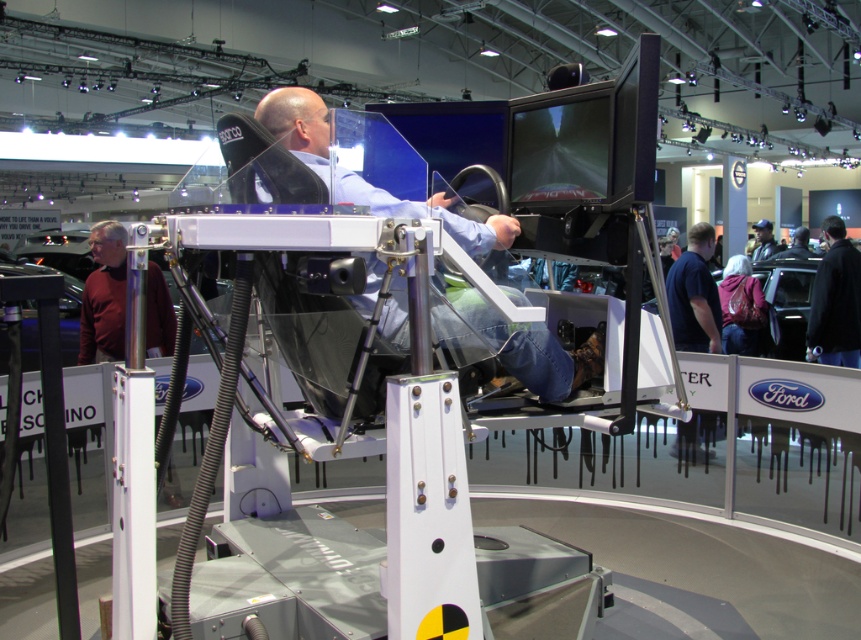
Measure the distance between matte black simulator at center and maroon sweater at left.

matte black simulator at center is 3.46 meters from maroon sweater at left.

This screenshot has height=640, width=861. In order to click on matte black simulator at center in this screenshot , I will do `click(367, 180)`.

Between matte black simulator at center and black leather jacket at lower right, which one appears on the right side from the viewer's perspective?

From the viewer's perspective, black leather jacket at lower right appears more on the right side.

Between point (578, 378) and point (827, 284), which one is positioned behind?

Positioned behind is point (827, 284).

Does point (472, 234) come closer to viewer compared to point (846, 301)?

Yes, it is.

In order to click on matte black simulator at center in this screenshot , I will do `click(367, 180)`.

Which of these two, maroon sweater at left or black leather jacket at lower right, stands shorter?

maroon sweater at left

I want to click on maroon sweater at left, so click(x=104, y=296).